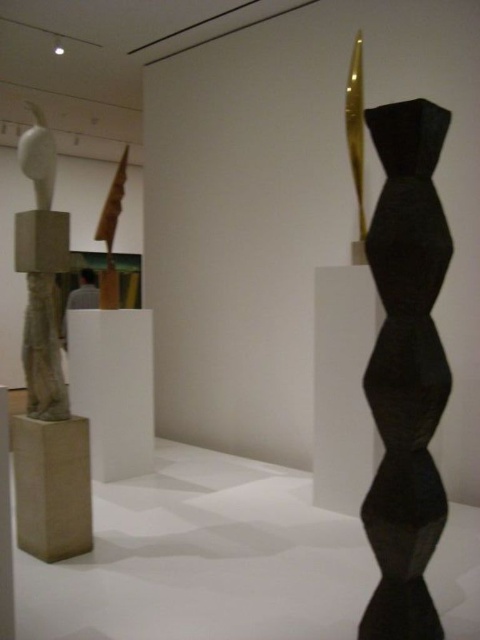
Question: Which object appears closest to the camera in this image?

Choices:
 (A) black matte hexagonal stack at right
 (B) matte stone sculpture at left

Answer: (A)

Question: From the image, what is the correct spatial relationship of black matte hexagonal stack at right in relation to matte stone sculpture at left?

Choices:
 (A) right
 (B) left

Answer: (A)

Question: Is black matte hexagonal stack at right to the left of matte stone sculpture at left from the viewer's perspective?

Choices:
 (A) yes
 (B) no

Answer: (B)

Question: Where is black matte hexagonal stack at right located in relation to matte stone sculpture at left in the image?

Choices:
 (A) left
 (B) right

Answer: (B)